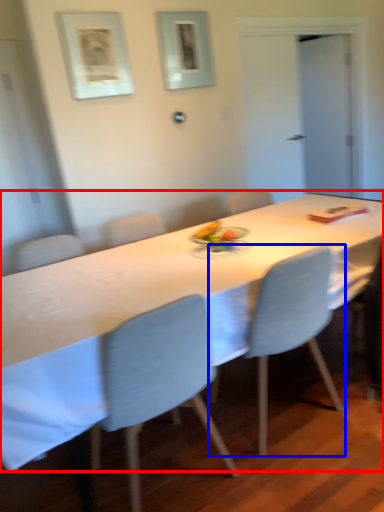
Question: Which of the following is the farthest to the observer, table (highlighted by a red box) or chair (highlighted by a blue box)?

Choices:
 (A) table
 (B) chair

Answer: (B)